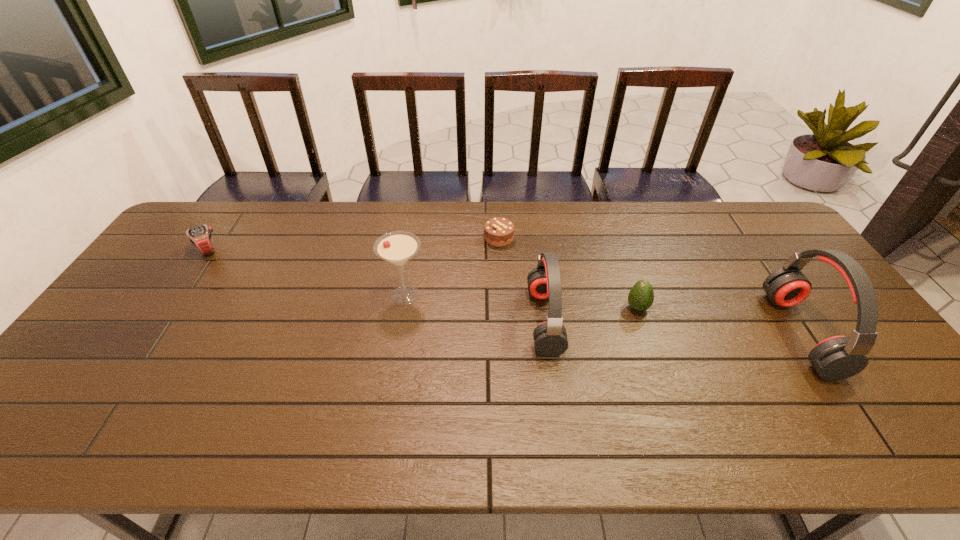
Locate an element on the screen. vacant space positioned on the ear cups of the third object from right to left is located at coordinates (504, 321).

The height and width of the screenshot is (540, 960). What are the coordinates of `free region located on the ear cups of the third object from right to left` in the screenshot? It's located at (449, 321).

This screenshot has width=960, height=540. In order to click on vacant space located on the ear cups of the tallest object in this screenshot , I will do `click(852, 334)`.

This screenshot has width=960, height=540. Identify the location of free space located on the right of the chocolate cake. (592, 238).

Identify the location of free spot located 0.070m on the front of the watch. The height and width of the screenshot is (540, 960). (190, 275).

What are the coordinates of `free location located 0.160m on the front of the fourth tallest object` in the screenshot? It's located at (657, 365).

Find the location of a particular element. vacant space located on the left of the second object from left to right is located at coordinates (301, 295).

I want to click on chocolate cake at the far edge, so point(498,232).

The height and width of the screenshot is (540, 960). I want to click on watch present at the far edge, so click(200, 236).

I want to click on object positioned at the near edge, so click(x=836, y=358).